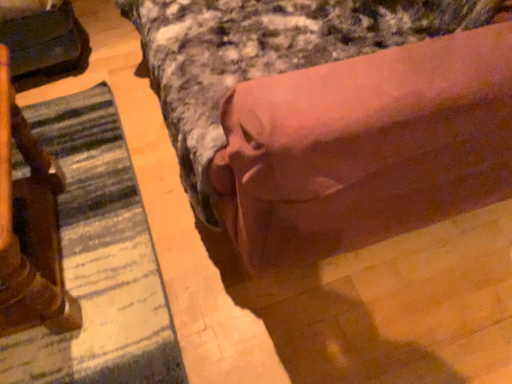
Question: Is striped fabric mat at lower left bigger or smaller than wooden statue at left?

Choices:
 (A) big
 (B) small

Answer: (B)

Question: From the image's perspective, is striped fabric mat at lower left above or below wooden statue at left?

Choices:
 (A) above
 (B) below

Answer: (B)

Question: Which object is the farthest from the striped fabric mat at lower left?

Choices:
 (A) brown fabric bed at center
 (B) matte black swivel chair at left
 (C) wooden statue at left

Answer: (A)

Question: Which object is the farthest from the brown fabric bed at center?

Choices:
 (A) wooden statue at left
 (B) matte black swivel chair at left
 (C) striped fabric mat at lower left

Answer: (B)